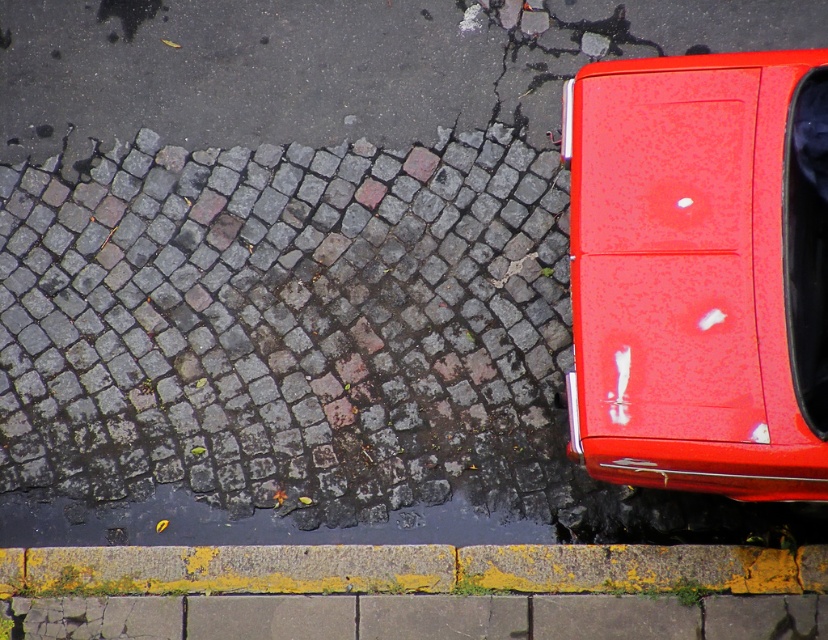
Question: Does glossy red car at lower right appear on the left side of yellow painted concrete curb at lower center?

Choices:
 (A) yes
 (B) no

Answer: (B)

Question: Does glossy red car at lower right come in front of yellow painted concrete curb at lower center?

Choices:
 (A) no
 (B) yes

Answer: (B)

Question: Which object appears farthest from the camera in this image?

Choices:
 (A) yellow painted concrete curb at lower center
 (B) glossy red car at lower right

Answer: (A)

Question: Can you confirm if glossy red car at lower right is positioned above yellow painted concrete curb at lower center?

Choices:
 (A) yes
 (B) no

Answer: (A)

Question: Which object appears closest to the camera in this image?

Choices:
 (A) glossy red car at lower right
 (B) yellow painted concrete curb at lower center

Answer: (A)